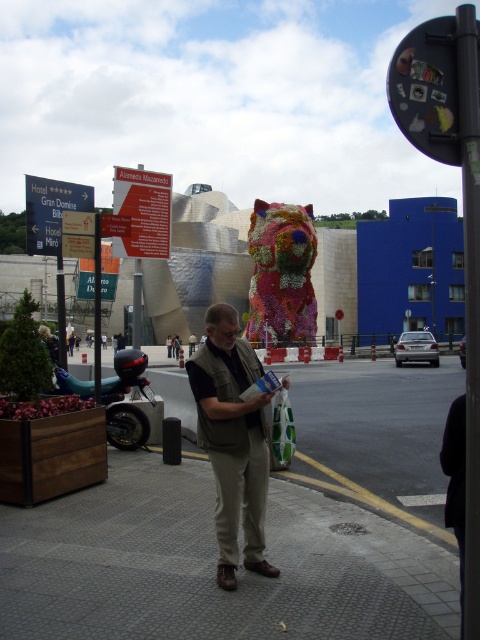
Question: Estimate the real-world distances between objects in this image. Which object is farther from the khaki cotton vest at center?

Choices:
 (A) gray textured pavement at center
 (B) fluffy fabric dog at center

Answer: (B)

Question: Does gray textured pavement at center have a greater width compared to khaki cotton vest at center?

Choices:
 (A) yes
 (B) no

Answer: (A)

Question: Can you confirm if gray textured pavement at center is positioned above fluffy fabric dog at center?

Choices:
 (A) yes
 (B) no

Answer: (B)

Question: Which point is farther from the camera taking this photo?

Choices:
 (A) (219, 467)
 (B) (274, 291)
 (C) (448, 595)

Answer: (B)

Question: Is the position of khaki cotton vest at center more distant than that of fluffy fabric dog at center?

Choices:
 (A) yes
 (B) no

Answer: (B)

Question: Which object is positioned closest to the khaki cotton vest at center?

Choices:
 (A) fluffy fabric dog at center
 (B) gray textured pavement at center

Answer: (B)